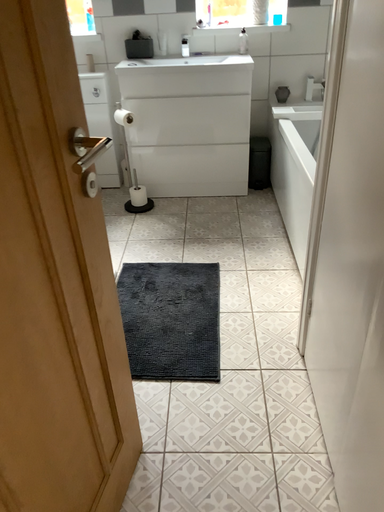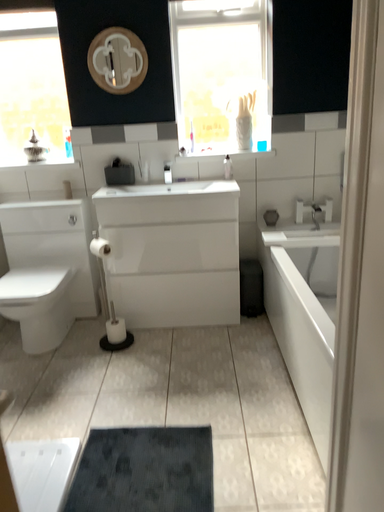
Question: Which way did the camera rotate in the video?

Choices:
 (A) rotated upward
 (B) rotated downward

Answer: (A)